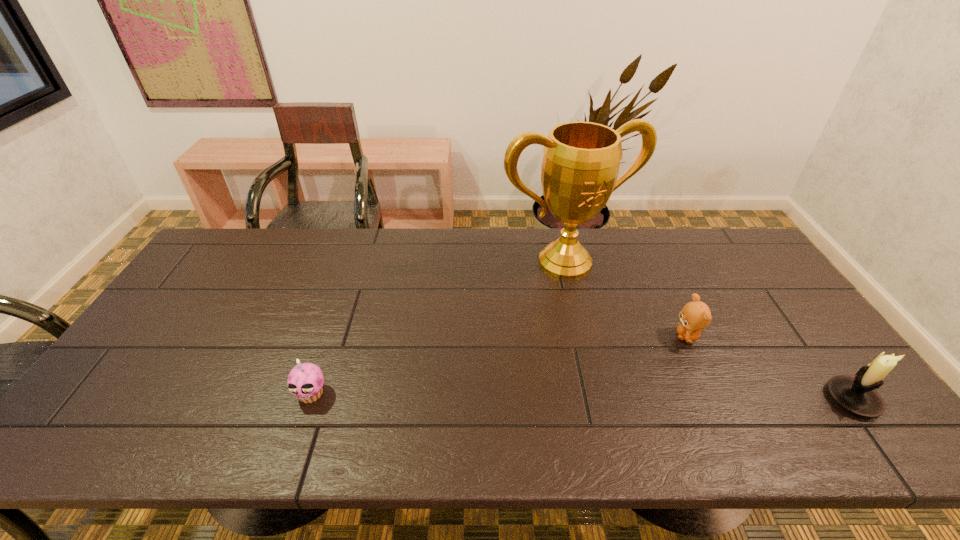
Find the location of `unoccupied area between the tallest object and the teddy bear`. unoccupied area between the tallest object and the teddy bear is located at coordinates (626, 299).

Where is `empty space between the farthest object and the third shortest object`? The height and width of the screenshot is (540, 960). empty space between the farthest object and the third shortest object is located at coordinates (708, 330).

Locate an element on the screen. empty location between the farthest object and the leftmost object is located at coordinates (438, 328).

Identify the location of free space between the teddy bear and the leftmost object. This screenshot has height=540, width=960. (499, 365).

Where is `free space between the award and the rightmost object`? free space between the award and the rightmost object is located at coordinates (708, 330).

Identify the location of object that is the closest to the third object from right to left. This screenshot has width=960, height=540. [x=695, y=315].

Locate an element on the screen. the second closest object to the second farthest object is located at coordinates (858, 395).

The image size is (960, 540). What are the coordinates of `free spot that satisfies the following two spatial constraints: 1. on the face of the cupcake; 2. on the left side of the rightmost object` in the screenshot? It's located at (309, 399).

This screenshot has height=540, width=960. What are the coordinates of `vacant position in the image that satisfies the following two spatial constraints: 1. on the front side of the third object from right to left; 2. on the left side of the third object from left to right` in the screenshot? It's located at (583, 336).

The height and width of the screenshot is (540, 960). I want to click on vacant space that satisfies the following two spatial constraints: 1. on the face of the candle holder; 2. on the left side of the cupcake, so click(x=309, y=399).